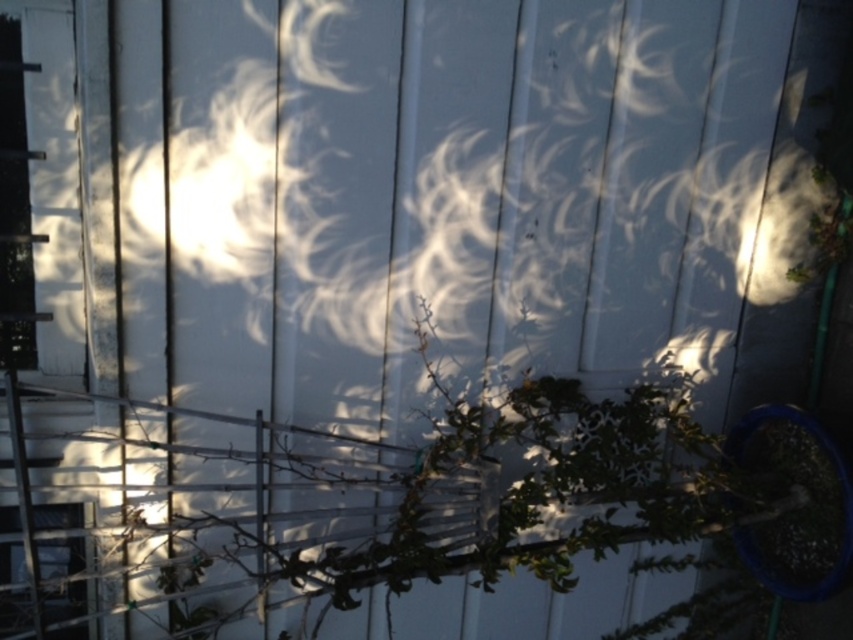
You are standing in front of the white corrugated metal wall and see the green leafy plant at center and the transparent glass window at lower left. Which object is closer to you?

The green leafy plant at center is closer to you as it is further to the viewer than the transparent glass window at lower left.

You are an interior designer planning to install a new lighting system. You need to know which object, the green leafy plant at center or the transparent glass window at lower left, is taller to ensure proper light placement. Which one is taller?

The green leafy plant at center is taller than the transparent glass window at lower left according to the description.

You are standing in front of the white corrugated metal wall and see the point at coordinates (502, 493). What object is located at that point?

The point at coordinates (502, 493) indicates a green leafy plant at center.